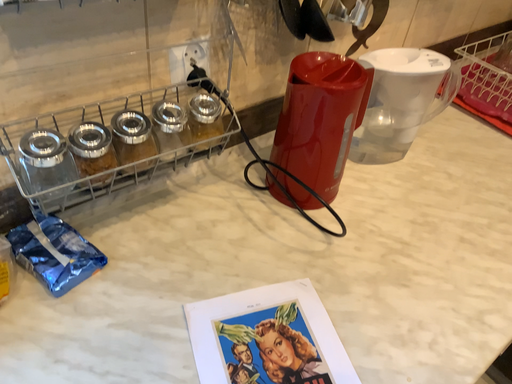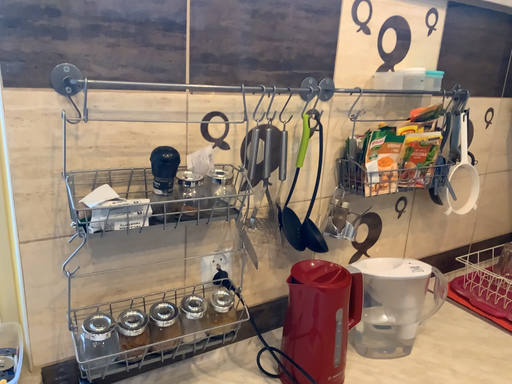
Question: How did the camera likely rotate when shooting the video?

Choices:
 (A) rotated right
 (B) rotated left

Answer: (B)